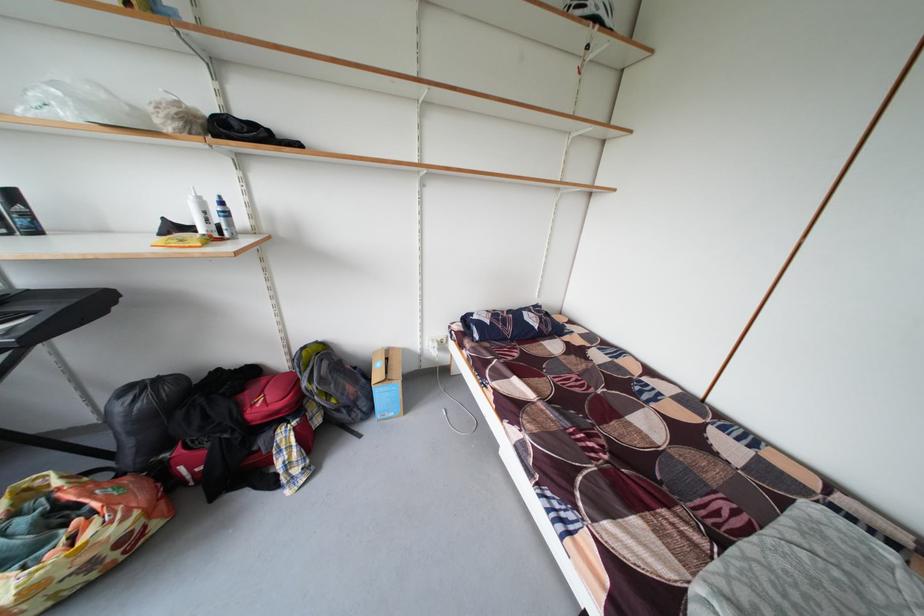
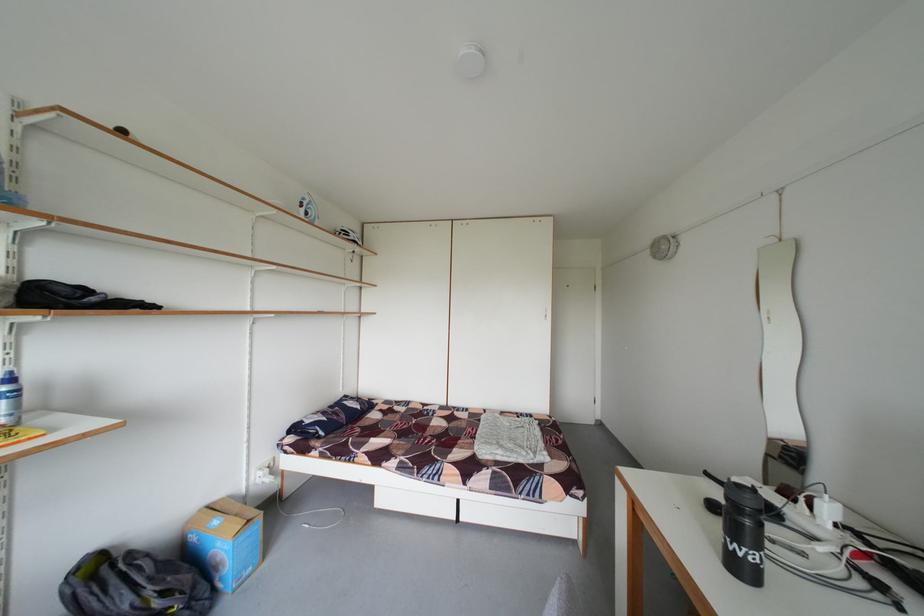
The point at (226, 205) is marked in the first image. Where is the corresponding point in the second image?

(10, 383)